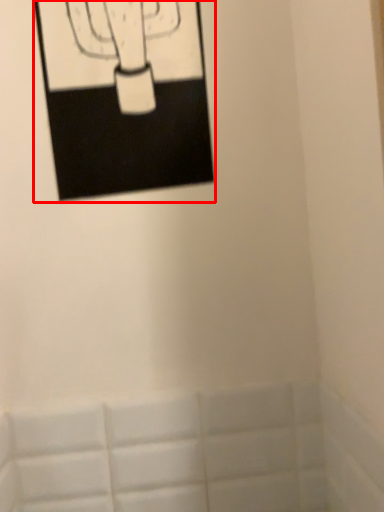
Question: From the image's perspective, where is picture frame (annotated by the red box) located in relation to bath in the image?

Choices:
 (A) above
 (B) below

Answer: (A)